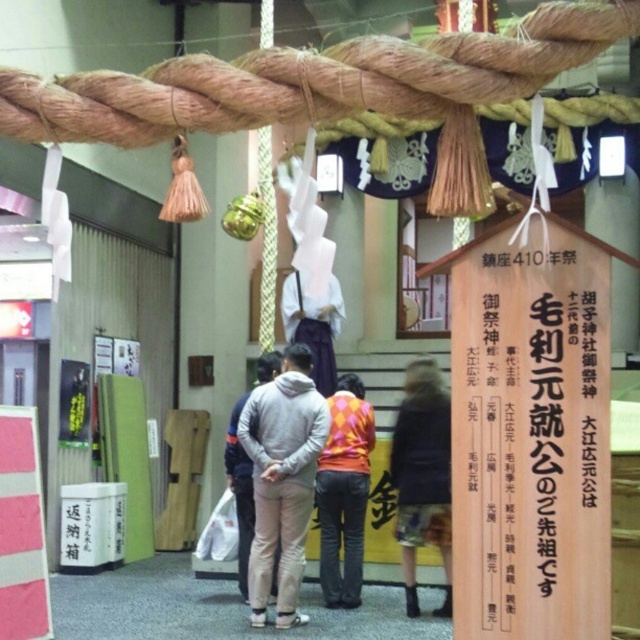
Question: Can you confirm if orange diamond-patterned sweater at center is thinner than gray fleece jacket at center?

Choices:
 (A) no
 (B) yes

Answer: (B)

Question: Which object is farther from the camera taking this photo?

Choices:
 (A) gray fleece jacket at center
 (B) dark blue fabric skirt at lower center
 (C) orange diamond-patterned sweater at center
 (D) gray fleece sweatshirt at center

Answer: (C)

Question: Is gray fleece sweatshirt at center to the right of gray fleece jacket at center from the viewer's perspective?

Choices:
 (A) yes
 (B) no

Answer: (A)

Question: Does dark blue fabric skirt at lower center appear under orange diamond-patterned sweater at center?

Choices:
 (A) no
 (B) yes

Answer: (A)

Question: Based on their relative distances, which object is nearer to the dark blue fabric skirt at lower center?

Choices:
 (A) gray fleece jacket at center
 (B) gray fleece sweatshirt at center
 (C) orange diamond-patterned sweater at center

Answer: (C)

Question: Which point is closer to the camera?

Choices:
 (A) dark blue fabric skirt at lower center
 (B) gray fleece jacket at center

Answer: (B)